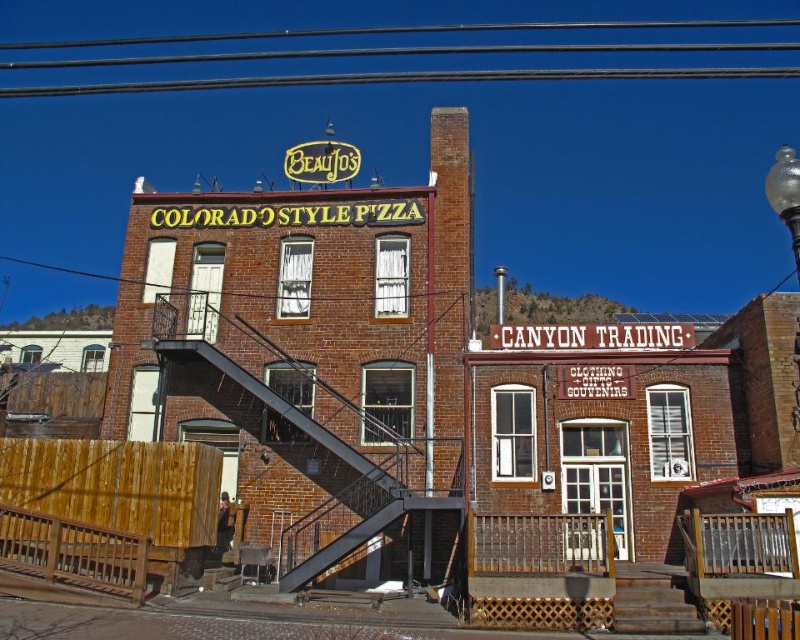
You are a delivery person trying to deliver a package to the second floor of the building. You see the metallic black staircase at center and the transparent glass globe at upper right. Which object is taller?

The transparent glass globe at upper right is taller than the metallic black staircase at center.

You are a visitor looking to enter the building and reach the second floor where the pizza restaurant is located. You see the metallic black staircase at center and the transparent glass globe at upper right. Which object should you approach first to reach the pizza restaurant?

You should approach the metallic black staircase at center first to reach the pizza restaurant because it is located below the transparent glass globe at upper right, indicating it leads to the upper level where the restaurant is situated.